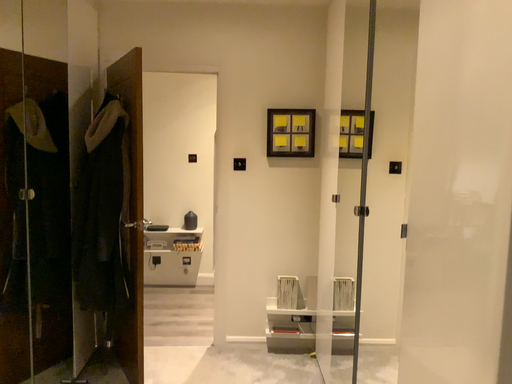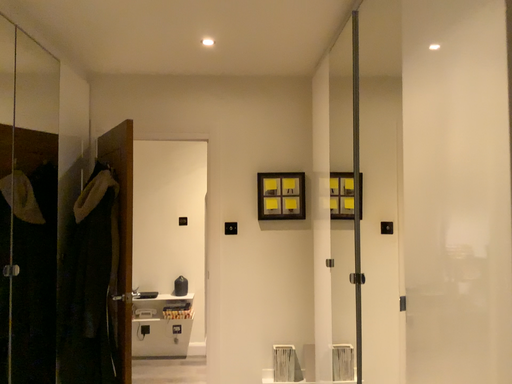
Question: How did the camera likely rotate when shooting the video?

Choices:
 (A) rotated upward
 (B) rotated downward

Answer: (A)